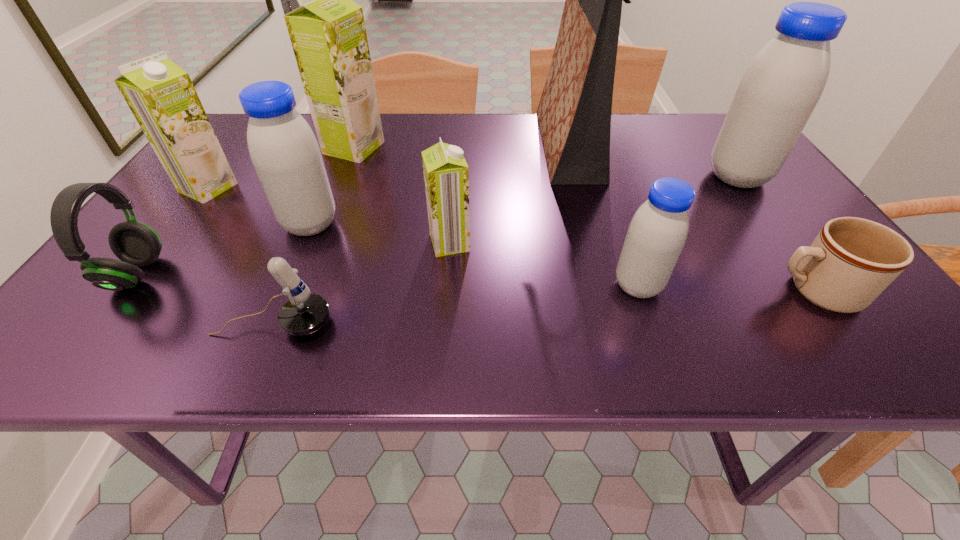
I want to click on vacant space that is in between the smallest green soya milk and the farthest green soya milk, so click(402, 195).

Find the location of a particular element. free space between the leftmost blue soya milk and the farthest blue soya milk is located at coordinates (524, 200).

This screenshot has height=540, width=960. Find the location of `the sixth closest object relative to the white microphone`. the sixth closest object relative to the white microphone is located at coordinates (656, 235).

Locate which object is the ninth closest to the headset. Please provide its 2D coordinates. Your answer should be formatted as a tuple, i.e. [(x, y)], where the tuple contains the x and y coordinates of a point satisfying the conditions above.

[(782, 85)]

Locate an element on the screen. soya milk that can be found as the closest to the tallest object is located at coordinates (782, 85).

Identify which soya milk is the third closest to the white microphone. Please provide its 2D coordinates. Your answer should be formatted as a tuple, i.e. [(x, y)], where the tuple contains the x and y coordinates of a point satisfying the conditions above.

[(160, 94)]

Locate an element on the screen. green soya milk that is the second closest one to the second smallest green soya milk is located at coordinates tap(446, 174).

Select which green soya milk appears as the second closest to the shopping bag. Please provide its 2D coordinates. Your answer should be formatted as a tuple, i.e. [(x, y)], where the tuple contains the x and y coordinates of a point satisfying the conditions above.

[(328, 35)]

Identify which blue soya milk is located as the nearest to the headset. Please provide its 2D coordinates. Your answer should be formatted as a tuple, i.e. [(x, y)], where the tuple contains the x and y coordinates of a point satisfying the conditions above.

[(285, 153)]

Find the location of a particular element. This screenshot has width=960, height=540. blue soya milk identified as the second closest to the nearest green soya milk is located at coordinates (656, 235).